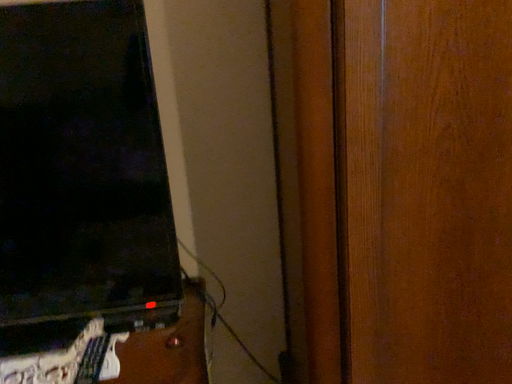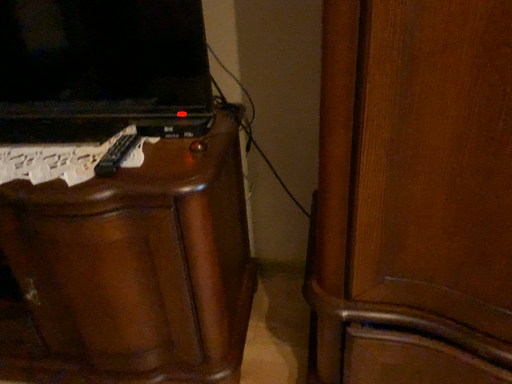
Question: Which way did the camera rotate in the video?

Choices:
 (A) rotated upward
 (B) rotated downward

Answer: (B)